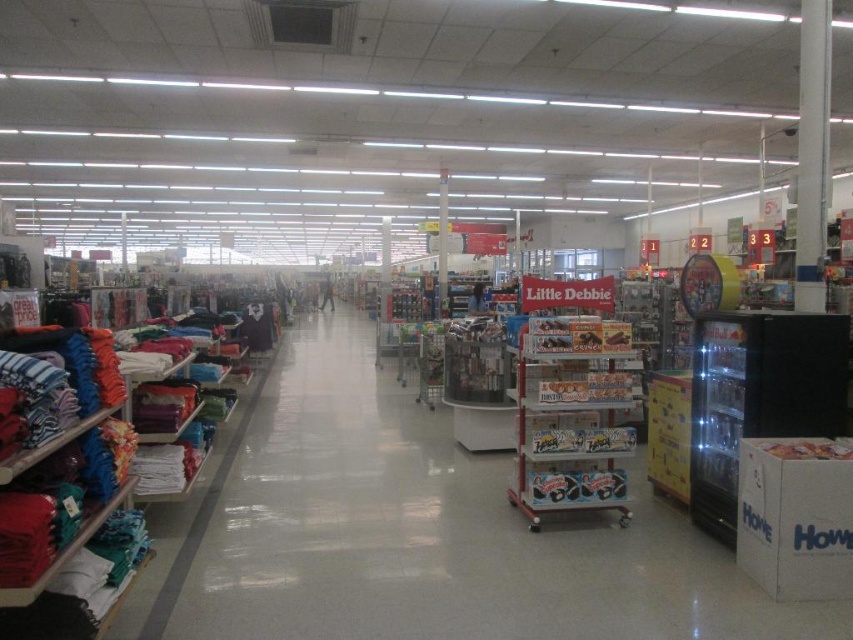
You are standing in the middle of the aisle and want to reach both the point at coordinates point (241, 588) and point (321, 291). Which point should you reach first to minimize the distance walked?

You should reach point (241, 588) first because it is closer to you than point (321, 291).